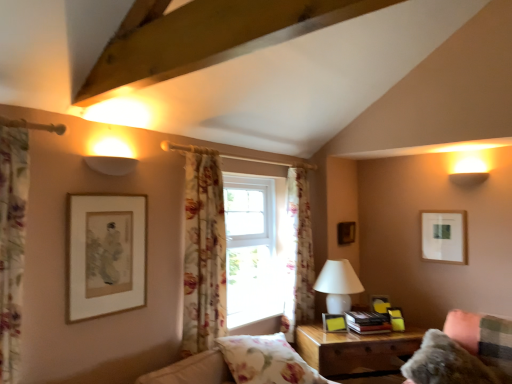
The width and height of the screenshot is (512, 384). I want to click on blank space above floral fabric curtain at center, placed as the second curtain when sorted from front to back (from a real-world perspective), so click(204, 151).